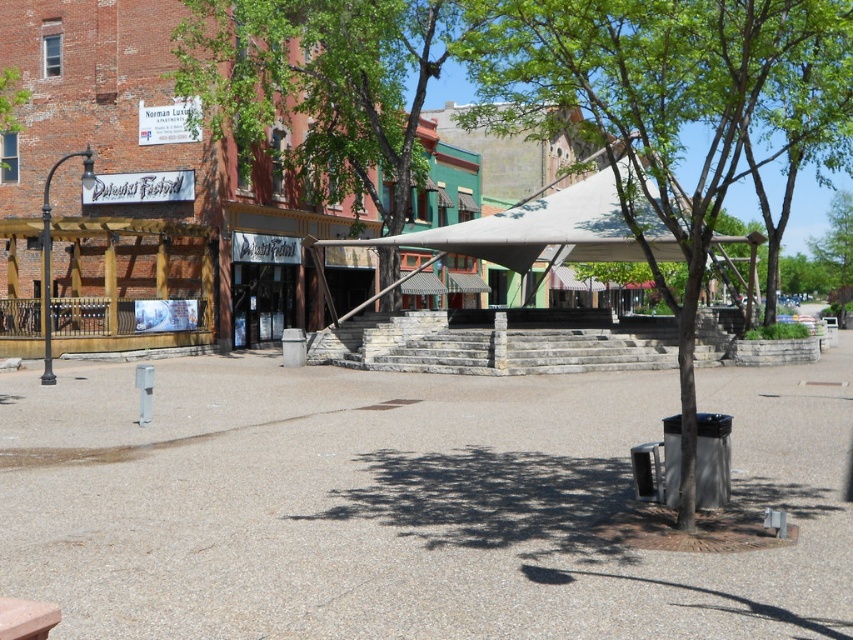
Question: Which is farther from the green leafy tree at upper center?

Choices:
 (A) white fabric canopy at center
 (B) green leafy tree at center

Answer: (B)

Question: Estimate the real-world distances between objects in this image. Which object is farther from the green leafy tree at center?

Choices:
 (A) white fabric canopy at center
 (B) green leafy tree at upper center

Answer: (B)

Question: In this image, where is green leafy tree at center located relative to white fabric canopy at center?

Choices:
 (A) above
 (B) below

Answer: (A)

Question: Is green leafy tree at upper center below white fabric canopy at center?

Choices:
 (A) no
 (B) yes

Answer: (A)

Question: Considering the real-world distances, which object is farthest from the white fabric canopy at center?

Choices:
 (A) green leafy tree at center
 (B) green leafy tree at upper center

Answer: (A)

Question: Does green leafy tree at center have a smaller size compared to white fabric canopy at center?

Choices:
 (A) no
 (B) yes

Answer: (A)